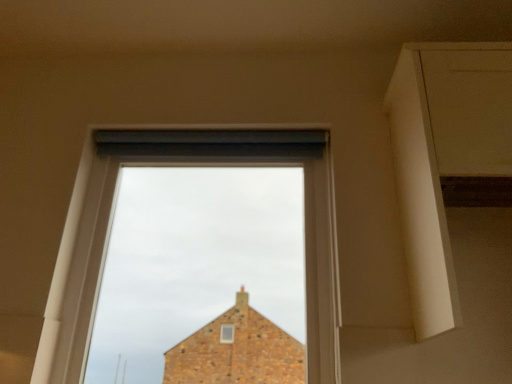
What do you see at coordinates (177, 164) in the screenshot? I see `matte glass window at center` at bounding box center [177, 164].

The image size is (512, 384). What are the coordinates of `matte glass window at center` in the screenshot? It's located at (177, 164).

Image resolution: width=512 pixels, height=384 pixels. What are the coordinates of `matte glass window at center` in the screenshot? It's located at (177, 164).